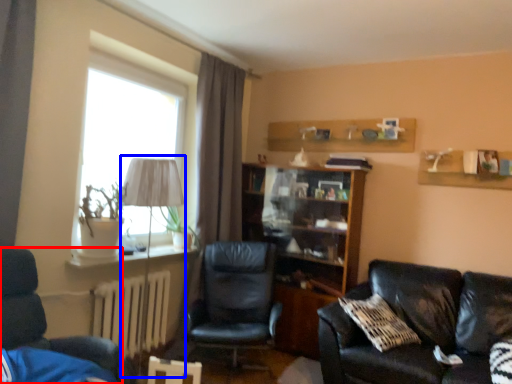
Question: Which object is closer to the camera taking this photo, chair (highlighted by a red box) or table lamp (highlighted by a blue box)?

Choices:
 (A) chair
 (B) table lamp

Answer: (A)